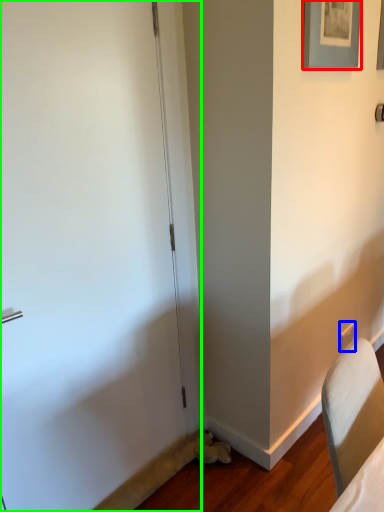
Question: Based on their relative distances, which object is nearer to picture frame (highlighted by a red box)? Choose from electric outlet (highlighted by a blue box) and door (highlighted by a green box).

Choices:
 (A) electric outlet
 (B) door

Answer: (B)